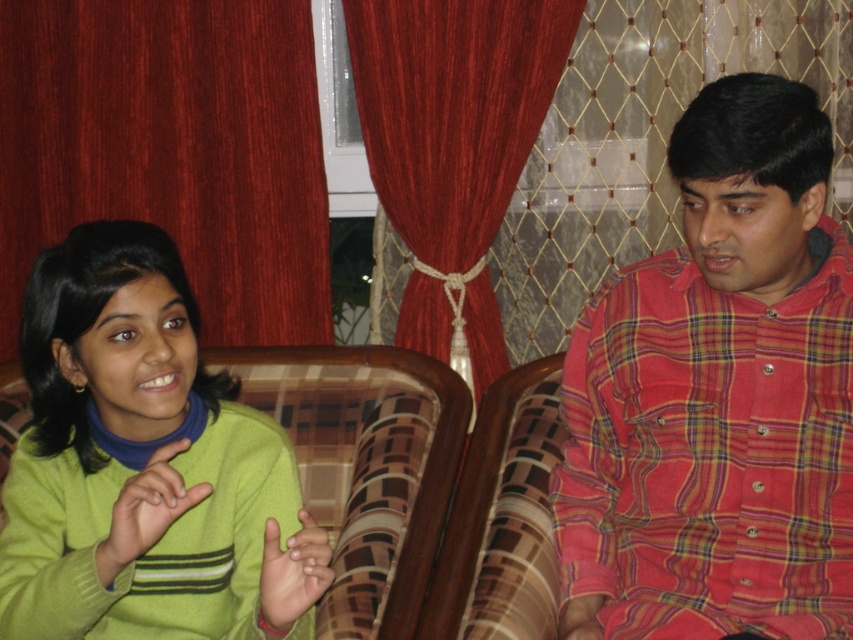
You are an interior designer assessing the proportions of the room. Given the green knitted sweater at left and the maroon fabric curtain at upper left, which object would you say occupies more space in the scene?

The green knitted sweater at left occupies more space in the scene as it is bigger than the maroon fabric curtain at upper left.

You are a photographer setting up a shoot in this scene. You want to position a light source so that it illuminates the red plaid shirt at right without affecting the green knitted sweater at left. Is this possible based on their positions?

The red plaid shirt at right is above the green knitted sweater at left, so positioning a light source above the red plaid shirt at right could illuminate it without affecting the lower positioned green knitted sweater at left.